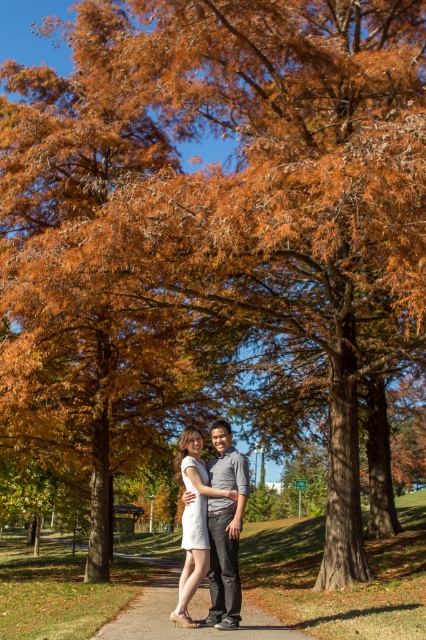
In the scene shown: Who is taller, gray cotton shirt at center or white matte dress at center?

Standing taller between the two is white matte dress at center.

Is point (235, 468) farther from camera compared to point (203, 493)?

That is True.

Does point (212, 568) come farther from viewer compared to point (186, 557)?

No, it is not.

The width and height of the screenshot is (426, 640). In order to click on gray cotton shirt at center in this screenshot , I will do `click(224, 528)`.

Between point (115, 628) and point (189, 593), which one is positioned in front?

Point (189, 593) is more forward.

Who is positioned more to the left, brown gravel path at center or white matte dress at center?

Positioned to the left is brown gravel path at center.

Describe the element at coordinates (172, 608) in the screenshot. I see `brown gravel path at center` at that location.

Locate an element on the screen. Image resolution: width=426 pixels, height=640 pixels. brown gravel path at center is located at coordinates (172, 608).

Can you confirm if brown gravel path at center is bigger than gray cotton shirt at center?

Yes, brown gravel path at center is bigger than gray cotton shirt at center.

Is point (172, 605) behind point (238, 502)?

Yes, point (172, 605) is behind point (238, 502).

The height and width of the screenshot is (640, 426). What are the coordinates of `brown gravel path at center` in the screenshot? It's located at (172, 608).